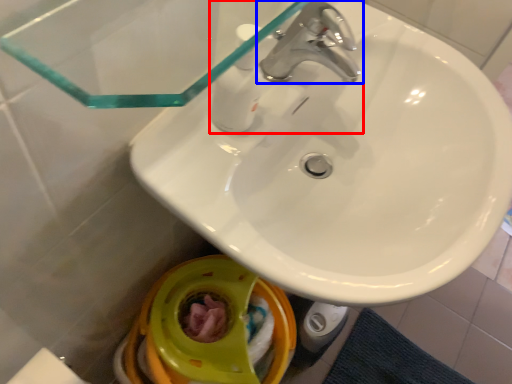
Question: Which object is closer to the camera taking this photo, tap (highlighted by a red box) or tap (highlighted by a blue box)?

Choices:
 (A) tap
 (B) tap

Answer: (A)